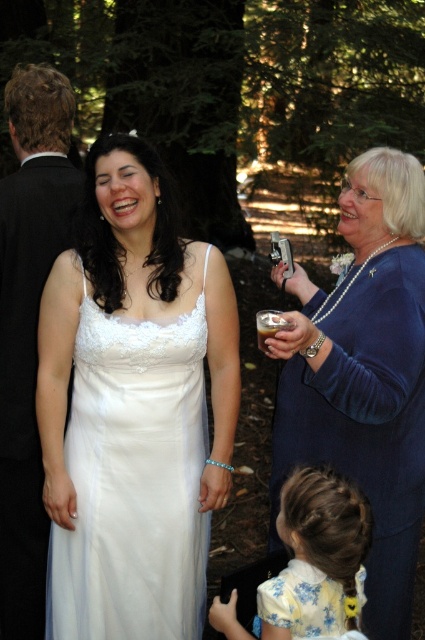
In the scene shown: Can you confirm if white satin dress at center is bigger than yellow floral dress at lower center?

Yes, white satin dress at center is bigger than yellow floral dress at lower center.

Describe the element at coordinates (133, 406) in the screenshot. I see `white satin dress at center` at that location.

Between point (79, 593) and point (221, 628), which one is positioned in front?

Point (221, 628) is in front.

Find the location of `white satin dress at center`. white satin dress at center is located at coordinates pyautogui.click(x=133, y=406).

Who is shorter, white satin dress at center or floral silk dress at lower center?

floral silk dress at lower center is shorter.

Describe the element at coordinates (133, 406) in the screenshot. I see `white satin dress at center` at that location.

Where is `white satin dress at center`? white satin dress at center is located at coordinates (133, 406).

Does blue velvet dress at right have a greater height compared to black satin suit at left?

Incorrect, blue velvet dress at right's height is not larger of black satin suit at left's.

Based on the photo, which is above, blue velvet dress at right or black satin suit at left?

black satin suit at left is above.

Does point (408, 291) come in front of point (17, 136)?

That is True.

Locate an element on the screen. blue velvet dress at right is located at coordinates (365, 376).